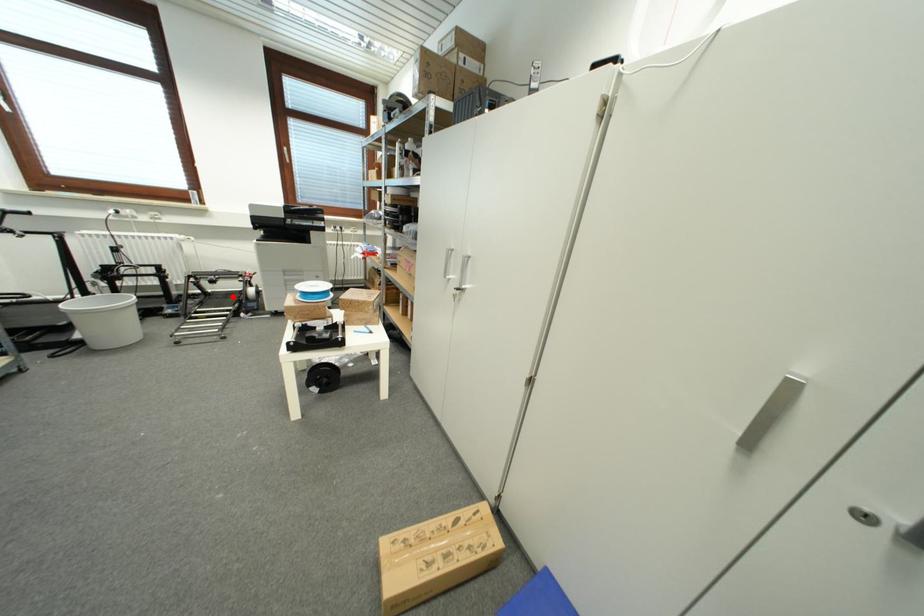
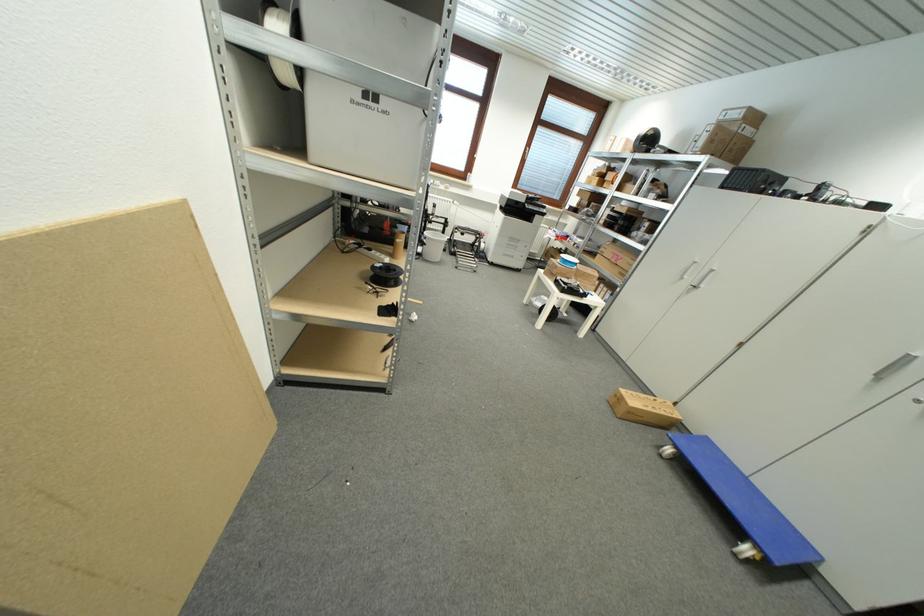
Question: A red point is marked in image1. In image2, is the corresponding 3D point closer to the camera or farther? Reply with the corresponding letter.

Choices:
 (A) The corresponding 3D point is closer.
 (B) The corresponding 3D point is farther.

Answer: (A)